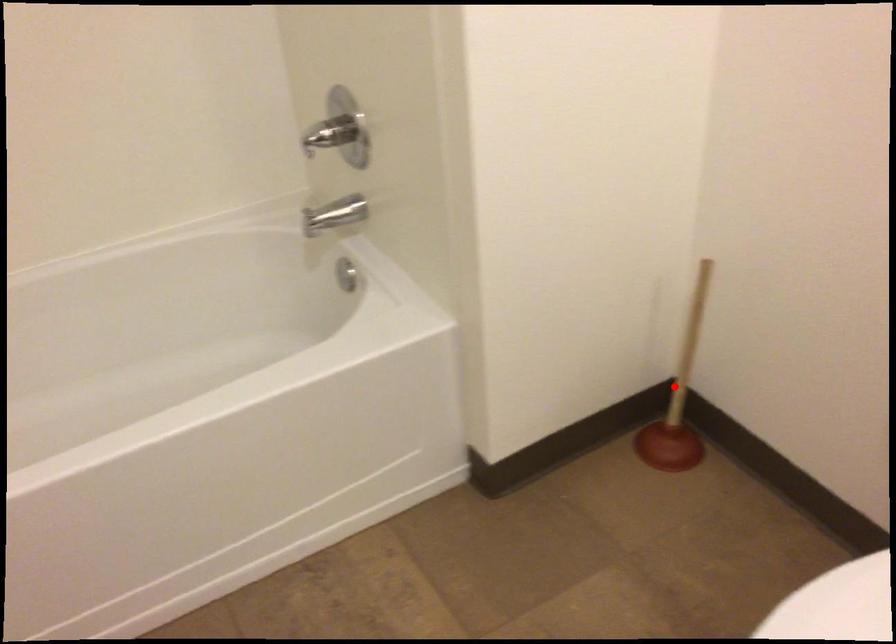
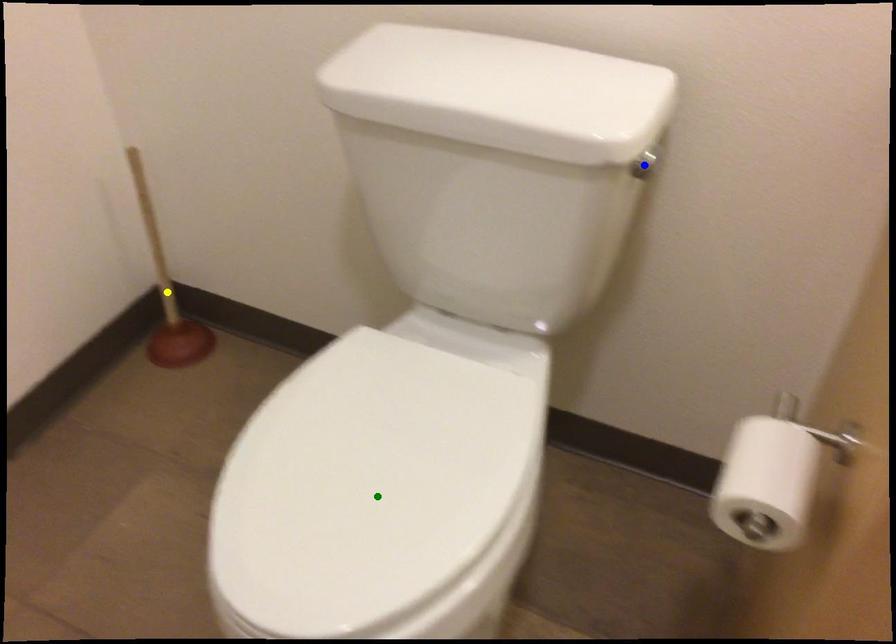
Question: I am providing you with two images of the same scene from different viewpoints. A red point is marked on the first image. You are given multiple points on the second image. In image 2, which mark is for the same physical point as the one in image 1?

Choices:
 (A) yellow point
 (B) blue point
 (C) green point

Answer: (A)